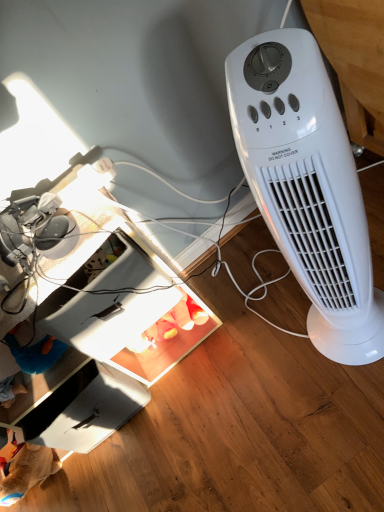
Where is `free space between white plastic heater at right and white plastic computer desk at lower left`? free space between white plastic heater at right and white plastic computer desk at lower left is located at coordinates (222, 382).